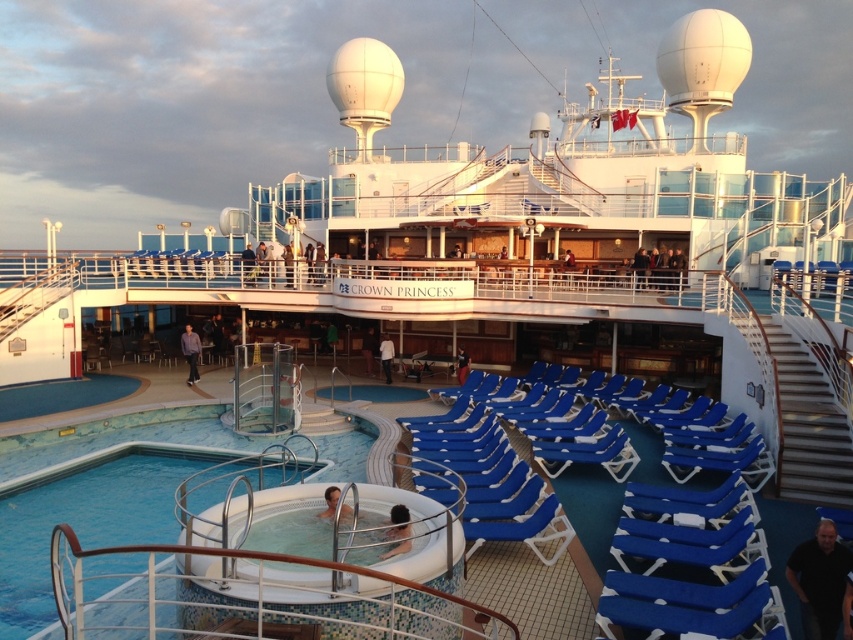
Question: Is purple cotton shirt at lower left bigger than blue fabric jacket at center?

Choices:
 (A) no
 (B) yes

Answer: (B)

Question: Can you confirm if white fabric shirt at center is positioned to the left of dark brown leather jacket at center?

Choices:
 (A) yes
 (B) no

Answer: (B)

Question: Which point is closer to the camera?

Choices:
 (A) white fabric shirt at center
 (B) black matte shirt at lower right

Answer: (B)

Question: Which of the following is the closest to the observer?

Choices:
 (A) (186, 342)
 (B) (392, 356)

Answer: (A)

Question: Is the position of smooth skin person at center less distant than that of dark brown leather jacket at center?

Choices:
 (A) yes
 (B) no

Answer: (A)

Question: Among these points, which one is farthest from the camera?

Choices:
 (A) (196, 356)
 (B) (389, 358)

Answer: (B)